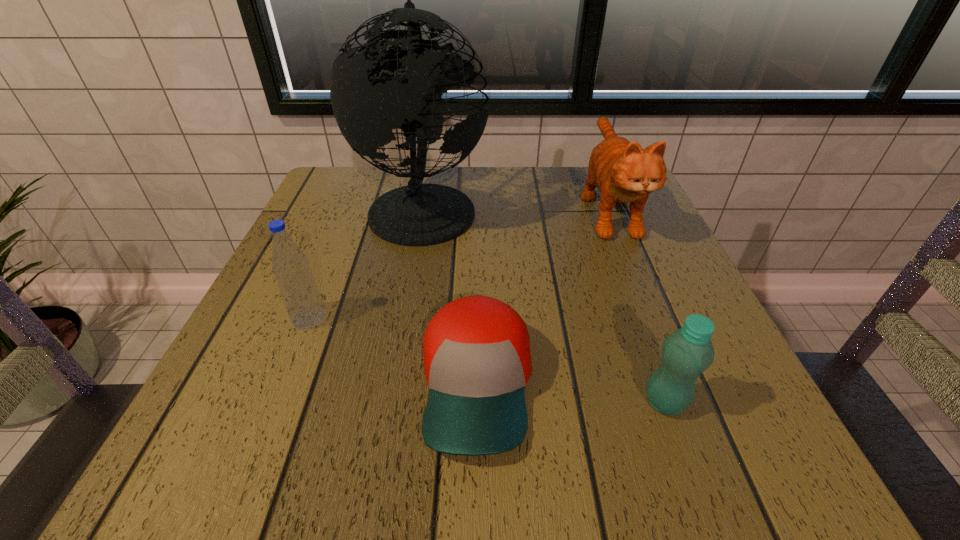
Image resolution: width=960 pixels, height=540 pixels. What are the coordinates of `globe` in the screenshot? It's located at (417, 214).

Identify the location of cat. The height and width of the screenshot is (540, 960). (623, 172).

This screenshot has width=960, height=540. Identify the location of the taller water bottle. (297, 285).

The image size is (960, 540). I want to click on the left water bottle, so click(x=297, y=285).

This screenshot has height=540, width=960. Identify the location of the second shortest object. (685, 354).

Find the location of `the shorter water bottle`. the shorter water bottle is located at coordinates (685, 354).

At what (x,y) coordinates should I click in order to perform the action: click on the shortest object. Please return your answer as a coordinate pair (x, y). Looking at the image, I should click on (477, 361).

This screenshot has height=540, width=960. Find the location of `vacant space located 0.060m on the front-facing side of the tallest object`. vacant space located 0.060m on the front-facing side of the tallest object is located at coordinates (515, 207).

At what (x,y) coordinates should I click in order to perform the action: click on vacant point located on the face of the cat. Please return your answer as a coordinate pair (x, y). The image size is (960, 540). Looking at the image, I should click on (659, 330).

Where is `blank area located on the right of the farther water bottle`? The width and height of the screenshot is (960, 540). blank area located on the right of the farther water bottle is located at coordinates (518, 318).